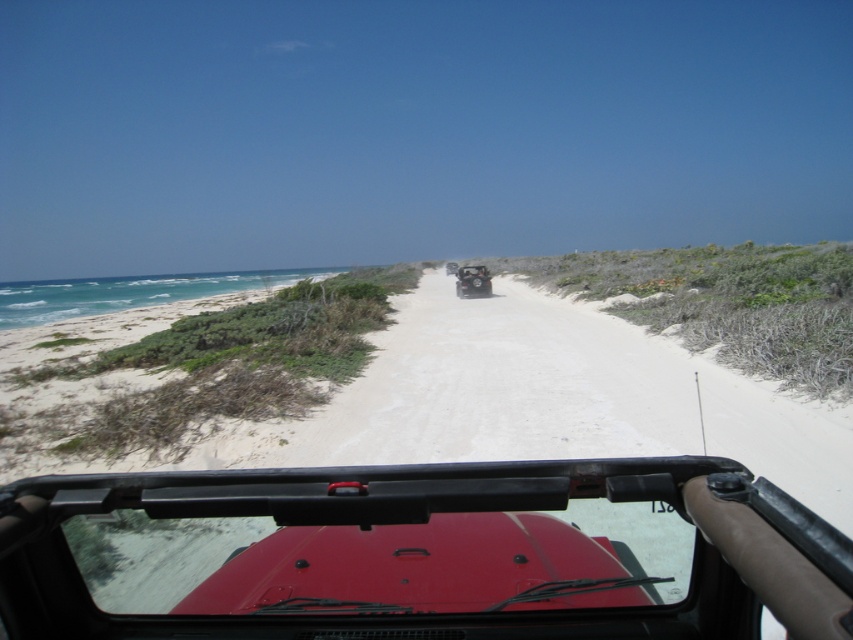
Can you confirm if matte red car at center is smaller than matte black jeep at center?

Yes.

Who is higher up, matte red car at center or matte black jeep at center?

matte black jeep at center

You are a GUI agent. You are given a task and a screenshot of the screen. Output one action in this format:
    pyautogui.click(x=<x>, y=<y>)
    Task: Click on the matte red car at center
    This screenshot has width=853, height=640.
    Given the screenshot: What is the action you would take?
    pyautogui.click(x=413, y=554)

You are a GUI agent. You are given a task and a screenshot of the screen. Output one action in this format:
    pyautogui.click(x=<x>, y=<y>)
    Task: Click on the matte red car at center
    The image size is (853, 640).
    Given the screenshot: What is the action you would take?
    (413, 554)

How distant is matte red car at center from matte red jeep at center?

They are 88.49 feet apart.

Between point (224, 538) and point (480, 282), which one is positioned behind?

Point (480, 282)

The image size is (853, 640). I want to click on matte red car at center, so click(x=413, y=554).

This screenshot has height=640, width=853. Identify the location of matte red car at center. (413, 554).

Does matte red jeep at center have a larger size compared to matte black jeep at center?

Incorrect, matte red jeep at center is not larger than matte black jeep at center.

The height and width of the screenshot is (640, 853). What do you see at coordinates (473, 282) in the screenshot? I see `matte red jeep at center` at bounding box center [473, 282].

Where is `matte red jeep at center`? The width and height of the screenshot is (853, 640). matte red jeep at center is located at coordinates (473, 282).